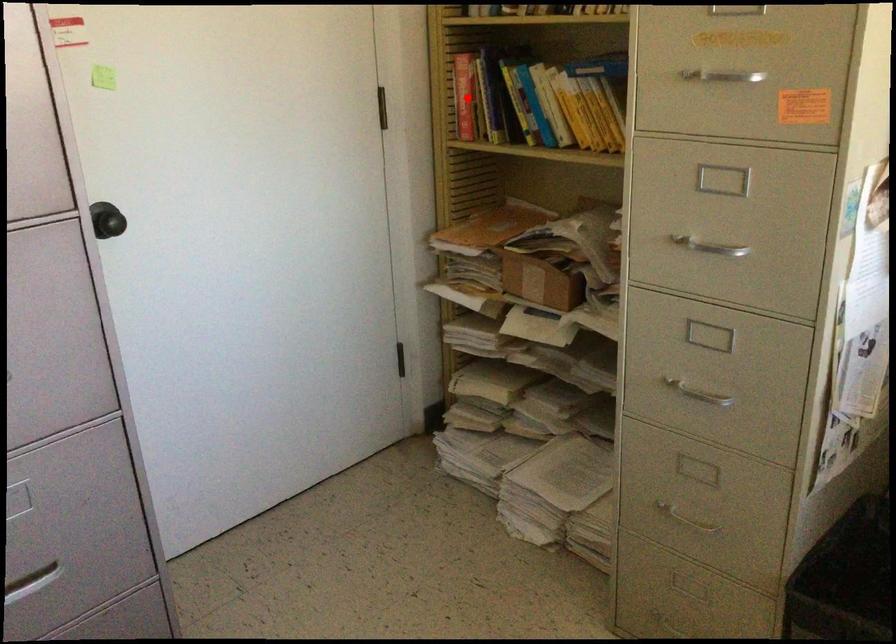
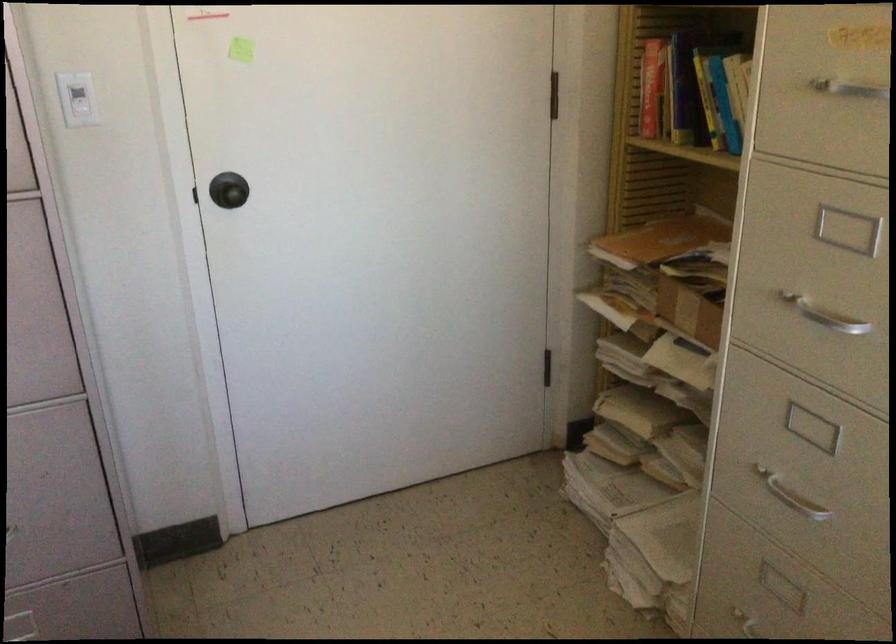
In the second image, find the point that corresponds to the highlighted location in the first image.

(650, 88)